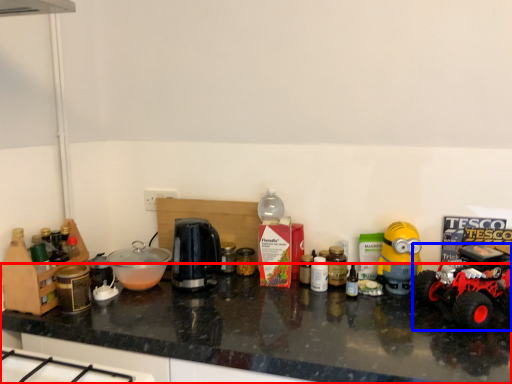
Question: Which object appears farthest to the camera in this image, countertop (highlighted by a red box) or land vehicle (highlighted by a blue box)?

Choices:
 (A) countertop
 (B) land vehicle

Answer: (B)